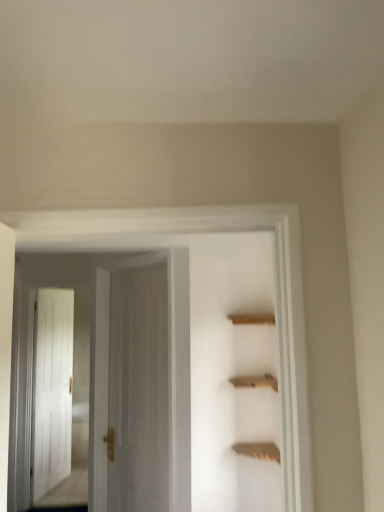
Question: From the image's perspective, would you say white glossy door at center, positioned as the first door in back-to-front order, is shown under wooden shelf at upper center?

Choices:
 (A) yes
 (B) no

Answer: (A)

Question: Considering the relative sizes of white glossy door at center, acting as the 2th door starting from the front, and wooden shelf at upper center in the image provided, is white glossy door at center, acting as the 2th door starting from the front, wider than wooden shelf at upper center?

Choices:
 (A) no
 (B) yes

Answer: (A)

Question: Is white glossy door at center, acting as the 2th door starting from the front, far away from wooden shelf at upper center?

Choices:
 (A) yes
 (B) no

Answer: (B)

Question: Is wooden shelf at upper center surrounded by white glossy door at center, positioned as the first door in back-to-front order?

Choices:
 (A) no
 (B) yes

Answer: (A)

Question: Is the depth of white glossy door at center, acting as the 2th door starting from the front, greater than that of wooden shelf at upper center?

Choices:
 (A) yes
 (B) no

Answer: (A)

Question: Does white glossy door at center, acting as the 2th door starting from the front, have a larger size compared to wooden shelf at upper center?

Choices:
 (A) yes
 (B) no

Answer: (A)

Question: From the image's perspective, is white glossy door at center, acting as the 2th door starting from the front, on top of white wooden door at center, the second door positioned from the back?

Choices:
 (A) yes
 (B) no

Answer: (B)

Question: Can you confirm if white glossy door at center, acting as the 2th door starting from the front, is shorter than white wooden door at center, the second door positioned from the back?

Choices:
 (A) no
 (B) yes

Answer: (A)

Question: Does white glossy door at center, acting as the 2th door starting from the front, come in front of white wooden door at center, placed as the 1th door when sorted from front to back?

Choices:
 (A) no
 (B) yes

Answer: (A)

Question: Is white glossy door at center, acting as the 2th door starting from the front, completely or partially outside of white wooden door at center, the second door positioned from the back?

Choices:
 (A) no
 (B) yes

Answer: (B)

Question: Is white glossy door at center, positioned as the first door in back-to-front order, taller than white wooden door at center, placed as the 1th door when sorted from front to back?

Choices:
 (A) no
 (B) yes

Answer: (B)

Question: Is white glossy door at center, acting as the 2th door starting from the front, to the left of white wooden door at center, the second door positioned from the back, from the viewer's perspective?

Choices:
 (A) yes
 (B) no

Answer: (A)

Question: From the image's perspective, is white wooden door at center, the second door positioned from the back, on top of wooden shelf at upper center?

Choices:
 (A) yes
 (B) no

Answer: (A)